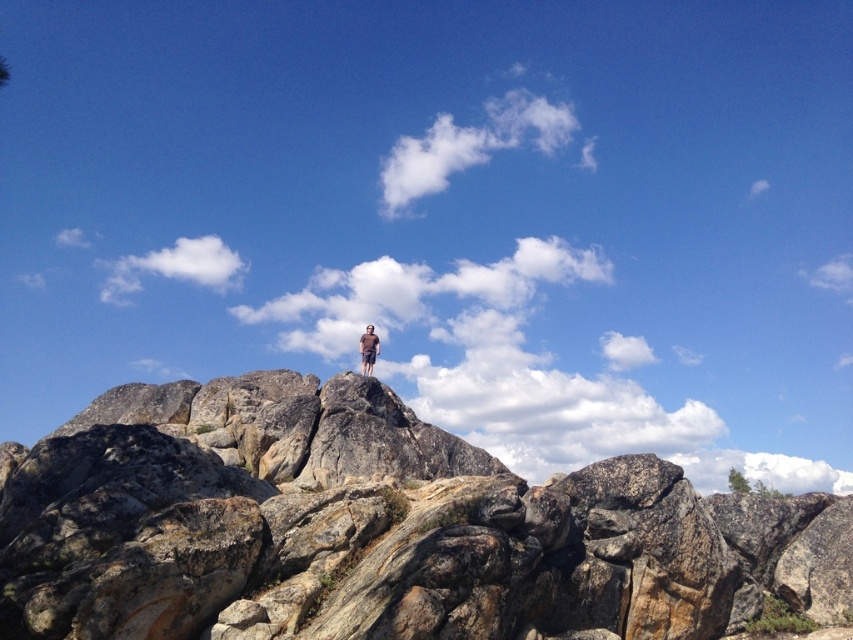
Question: Which object is closer to the camera taking this photo?

Choices:
 (A) brown cotton shirt at center
 (B) rough granite boulder at center

Answer: (B)

Question: Does rough granite boulder at center appear on the right side of brown cotton shirt at center?

Choices:
 (A) no
 (B) yes

Answer: (B)

Question: In this image, where is rough granite boulder at center located relative to brown cotton shirt at center?

Choices:
 (A) left
 (B) right

Answer: (B)

Question: Does rough granite boulder at center have a greater width compared to brown cotton shirt at center?

Choices:
 (A) no
 (B) yes

Answer: (B)

Question: Which point is closer to the camera?

Choices:
 (A) rough granite boulder at center
 (B) brown cotton shirt at center

Answer: (A)